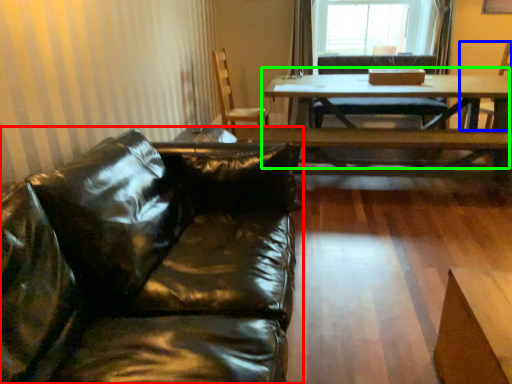
Question: Estimate the real-world distances between objects in this image. Which object is farther from studio couch (highlighted by a red box), armchair (highlighted by a blue box) or table (highlighted by a green box)?

Choices:
 (A) armchair
 (B) table

Answer: (A)